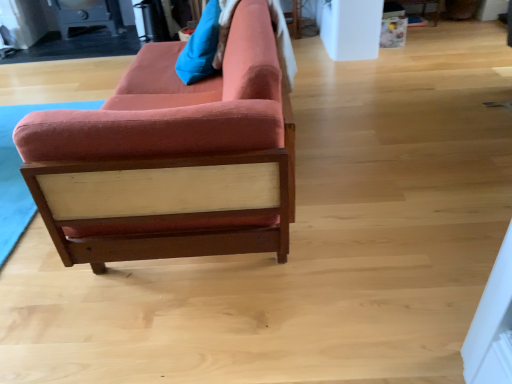
The width and height of the screenshot is (512, 384). What do you see at coordinates (200, 47) in the screenshot?
I see `blue fabric pillow at upper center` at bounding box center [200, 47].

The width and height of the screenshot is (512, 384). I want to click on blue fabric pillow at upper center, so click(200, 47).

In order to face velvet red couch at left, should I rotate leftwards or rightwards?

Rotate left and turn 8.828 degrees.

Describe the element at coordinates (172, 158) in the screenshot. I see `velvet red couch at left` at that location.

Locate an element on the screen. This screenshot has width=512, height=384. velvet red couch at left is located at coordinates (172, 158).

I want to click on blue fabric pillow at upper center, so click(x=200, y=47).

Is velvet red couch at left to the right of blue fabric pillow at upper center from the viewer's perspective?

Yes.

Consider the image. Between velvet red couch at left and blue fabric pillow at upper center, which one is positioned in front?

velvet red couch at left.

Is point (180, 141) more distant than point (194, 41)?

No, it is not.

From the image's perspective, relative to blue fabric pillow at upper center, is velvet red couch at left above or below?

From the image's perspective, velvet red couch at left appears below blue fabric pillow at upper center.

From a real-world perspective, is velvet red couch at left beneath blue fabric pillow at upper center?

Yes, from a real-world perspective, velvet red couch at left is beneath blue fabric pillow at upper center.

Which of these two, velvet red couch at left or blue fabric pillow at upper center, is thinner?

blue fabric pillow at upper center is thinner.

Which of these two, velvet red couch at left or blue fabric pillow at upper center, stands taller?

With more height is velvet red couch at left.

Between velvet red couch at left and blue fabric pillow at upper center, which one has larger size?

velvet red couch at left.

Is velvet red couch at left situated inside blue fabric pillow at upper center or outside?

velvet red couch at left is spatially situated outside blue fabric pillow at upper center.

Can you see velvet red couch at left touching blue fabric pillow at upper center?

They are not placed beside each other.

Is velvet red couch at left oriented towards blue fabric pillow at upper center?

Yes.

Can you tell me how much velvet red couch at left and blue fabric pillow at upper center differ in facing direction?

0.000888 degrees.

Measure the distance from velvet red couch at left to blue fabric pillow at upper center.

29.65 inches.

Locate an element on the screen. pillow that appears on the left of velvet red couch at left is located at coordinates (200, 47).

Based on the photo, in the image, is blue fabric pillow at upper center on the left side or the right side of velvet red couch at left?

From the image, it's evident that blue fabric pillow at upper center is to the left of velvet red couch at left.

Is blue fabric pillow at upper center closer to the viewer compared to velvet red couch at left?

That is False.

Which is nearer, (188,82) or (23,142)?

Point (188,82) appears to be farther away from the viewer than point (23,142).

From the image's perspective, between blue fabric pillow at upper center and velvet red couch at left, which one is located above?

blue fabric pillow at upper center is shown above in the image.

From the picture: From a real-world perspective, is blue fabric pillow at upper center physically below velvet red couch at left?

Incorrect, from a real-world perspective, blue fabric pillow at upper center is higher than velvet red couch at left.

Considering the relative sizes of blue fabric pillow at upper center and velvet red couch at left in the image provided, is blue fabric pillow at upper center thinner than velvet red couch at left?

Indeed, blue fabric pillow at upper center has a lesser width compared to velvet red couch at left.

Between blue fabric pillow at upper center and velvet red couch at left, which one has more height?

velvet red couch at left.

Who is bigger, blue fabric pillow at upper center or velvet red couch at left?

With larger size is velvet red couch at left.

Is blue fabric pillow at upper center located outside velvet red couch at left?

No, most part of blue fabric pillow at upper center lies within velvet red couch at left.

Are blue fabric pillow at upper center and velvet red couch at left making contact?

No, blue fabric pillow at upper center is not touching velvet red couch at left.

Is blue fabric pillow at upper center oriented away from velvet red couch at left?

That's right, blue fabric pillow at upper center is facing away from velvet red couch at left.

How distant is blue fabric pillow at upper center from velvet red couch at left?

They are 29.65 inches apart.

At what (x,y) coordinates should I click in order to perform the action: click on pillow lying above the velvet red couch at left (from the image's perspective). Please return your answer as a coordinate pair (x, y). This screenshot has height=384, width=512. Looking at the image, I should click on (200, 47).

Find the location of a particular element. The height and width of the screenshot is (384, 512). pillow behind the velvet red couch at left is located at coordinates (200, 47).

This screenshot has height=384, width=512. Identify the location of studio couch below the blue fabric pillow at upper center (from the image's perspective). (172, 158).